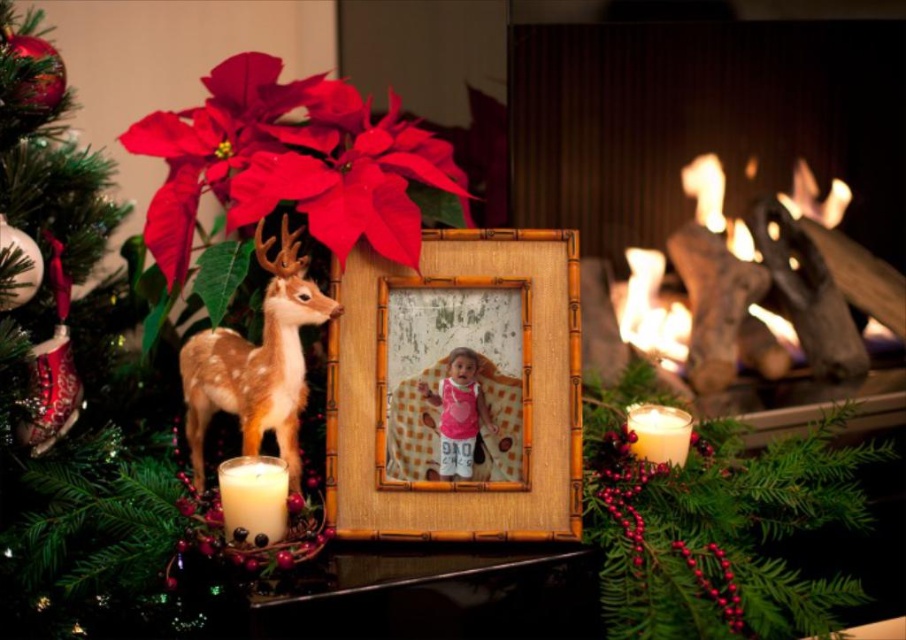
Question: Can you confirm if green matte christmas tree at left is positioned below frosted glass deer at center?

Choices:
 (A) yes
 (B) no

Answer: (B)

Question: Is bright red matte poinsettia at upper center thinner than white matte candle at lower left?

Choices:
 (A) no
 (B) yes

Answer: (A)

Question: Does bamboo textured photo frame at center appear under translucent glass candle at lower right?

Choices:
 (A) no
 (B) yes

Answer: (A)

Question: Which object is farther from the camera taking this photo?

Choices:
 (A) bamboo textured photo frame at center
 (B) green matte christmas tree at left
 (C) white matte candle at lower left

Answer: (A)

Question: Which object is the farthest from the translucent glass candle at lower right?

Choices:
 (A) white matte candle at lower left
 (B) pink fabric at center
 (C) bamboo textured photo frame at center
 (D) bright red matte poinsettia at upper center

Answer: (A)

Question: Estimate the real-world distances between objects in this image. Which object is closer to the translucent glass candle at lower right?

Choices:
 (A) white wax candle at lower right
 (B) green matte christmas tree at left
 (C) bamboo textured photo frame at center

Answer: (A)